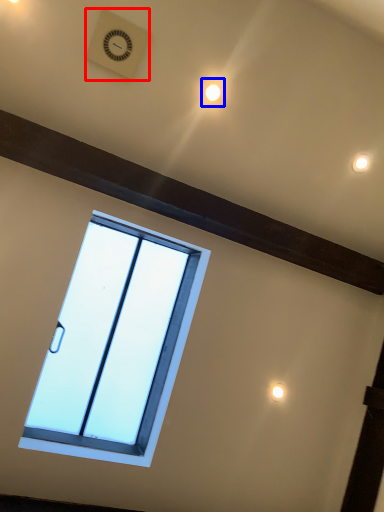
Question: Among these objects, which one is nearest to the camera, clock (highlighted by a red box) or light (highlighted by a blue box)?

Choices:
 (A) clock
 (B) light

Answer: (A)